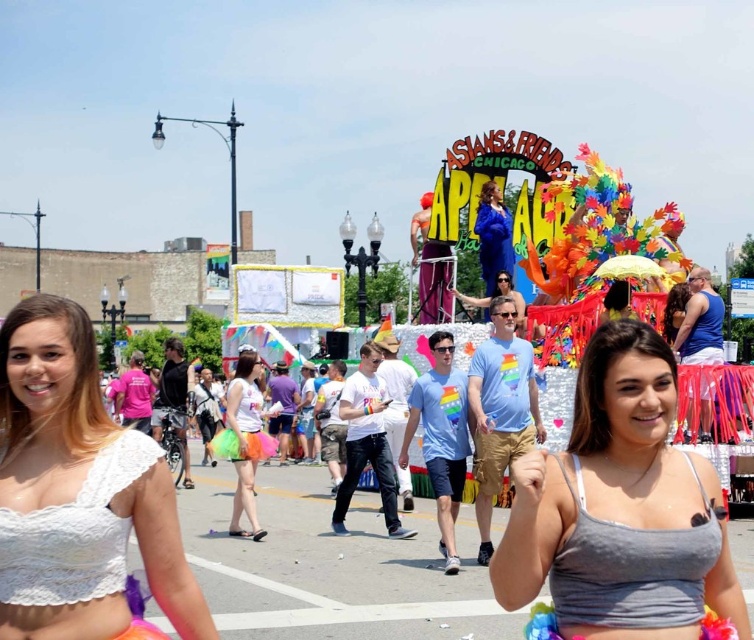
You are a photographer at the parade and want to capture both the rainbow tulle skirt at center and the matte blue dress at center in a single shot. Based on their positions, which one should you focus on first to ensure both are in frame?

Answer: The rainbow tulle skirt at center is located below the matte blue dress at center, so you should focus on the matte blue dress at center first to ensure both are in frame.

You are a photographer at the parade and want to capture both the gray fabric top at center and the white lace bikini top at lower left in a single frame. Which top should you zoom out slightly to ensure both are fully visible?

You should zoom out slightly to accommodate the gray fabric top at center because its width is larger than the white lace bikini top at lower left, ensuring both fit within the frame.